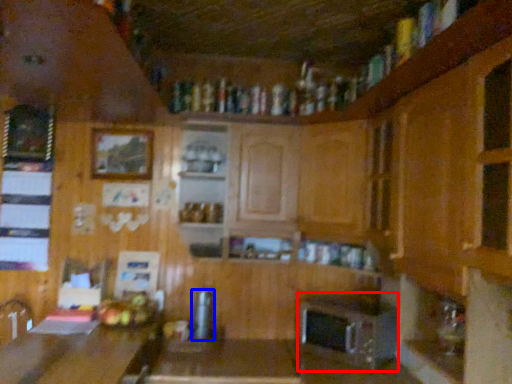
Question: Among these objects, which one is nearest to the camera, appliance (highlighted by a red box) or appliance (highlighted by a blue box)?

Choices:
 (A) appliance
 (B) appliance

Answer: (A)